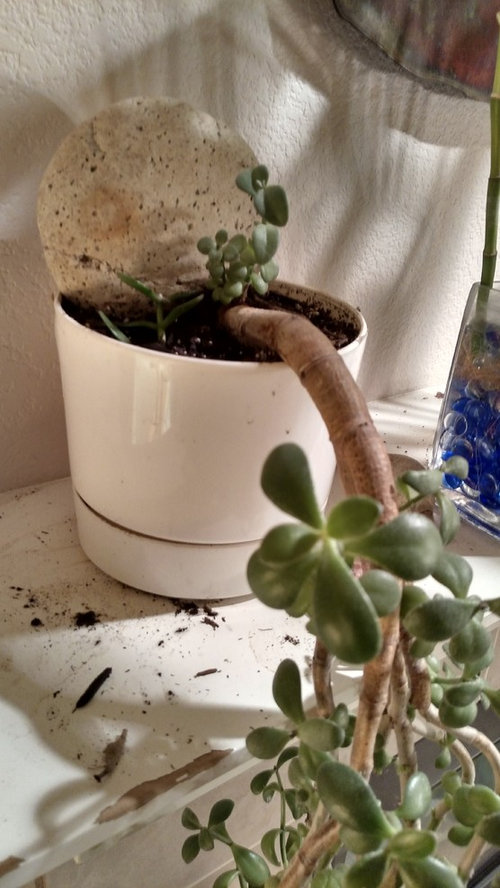
Identify the location of decorative rock. The height and width of the screenshot is (888, 500). (157, 177).